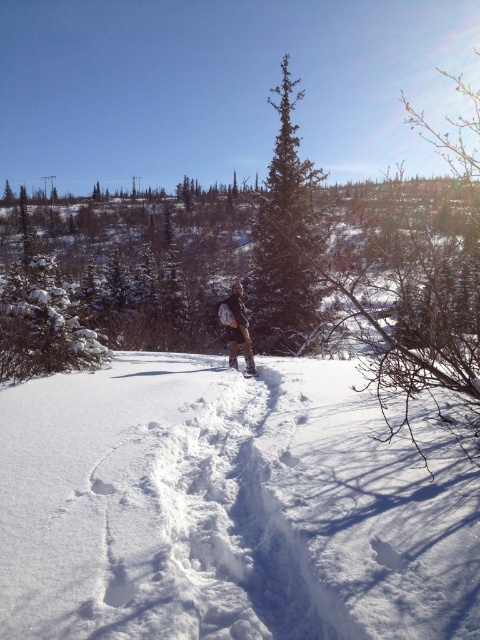
Question: Which of the following is the closest to the observer?

Choices:
 (A) (256, 374)
 (B) (320, 246)
 (C) (241, 330)

Answer: (C)

Question: Which point is farther to the camera?

Choices:
 (A) white fluffy snow at center
 (B) green coniferous tree at center
 (C) brown fabric backpack at center
 (D) white rubber snowshoe at center

Answer: (D)

Question: Among these points, which one is farthest from the camera?

Choices:
 (A) (22, 419)
 (B) (238, 333)
 (C) (255, 369)
 (D) (285, 134)

Answer: (D)

Question: Does white fluffy snow at center have a larger size compared to white rubber snowshoe at center?

Choices:
 (A) no
 (B) yes

Answer: (B)

Question: Does green coniferous tree at center lie behind white rubber snowshoe at center?

Choices:
 (A) yes
 (B) no

Answer: (B)

Question: Is white fluffy snow at center bigger than green coniferous tree at center?

Choices:
 (A) yes
 (B) no

Answer: (B)